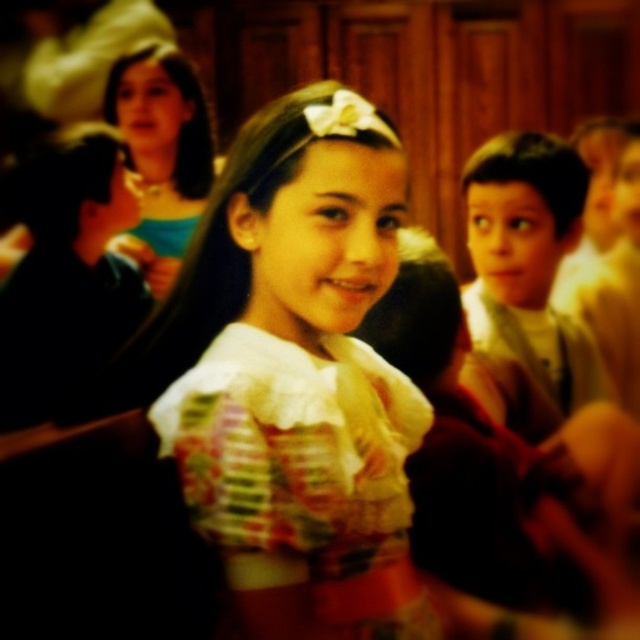
You are a photographer trying to adjust the focus of your camera to capture the white lace dress at center and the light brown hair at right. Based on their positions, which object should you focus on first to ensure both are in sharp focus?

The white lace dress at center is located below light brown hair at right. To ensure both are in sharp focus, you should focus on the light brown hair at right first since it is closer to the camera, and the dress is further away, allowing the depth of field to cover both.

Looking at the image, there is a young girl in the foreground wearing a white blouse with ruffled details and a colorful, patterned skirt. The background has other children dressed similarly. Can you tell me what the point at coordinates [301,378] represents?

The point at coordinates [301,378] marks the white lace dress at center.

You are a photographer who needs to adjust the camera focus to capture both the white lace dress at center and the matte floral dress at center clearly. Given the current camera settings, the depth of field can only cover 10 inches. Will you need to adjust the focus to ensure both dresses are in focus?

The distance between the white lace dress at center and the matte floral dress at center is 11.48 inches. Since the depth of field can only cover 10 inches, you will need to adjust the focus to ensure both dresses are in focus.